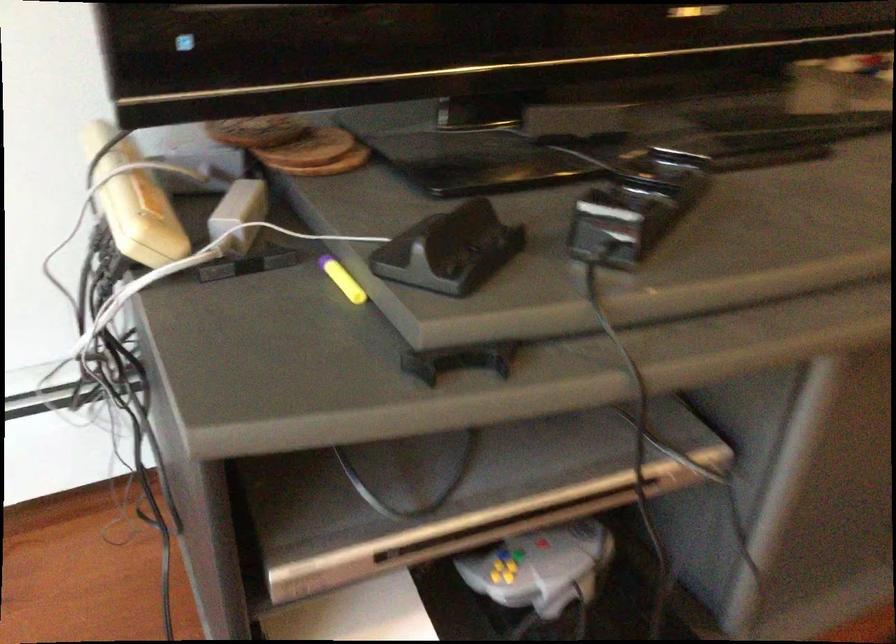
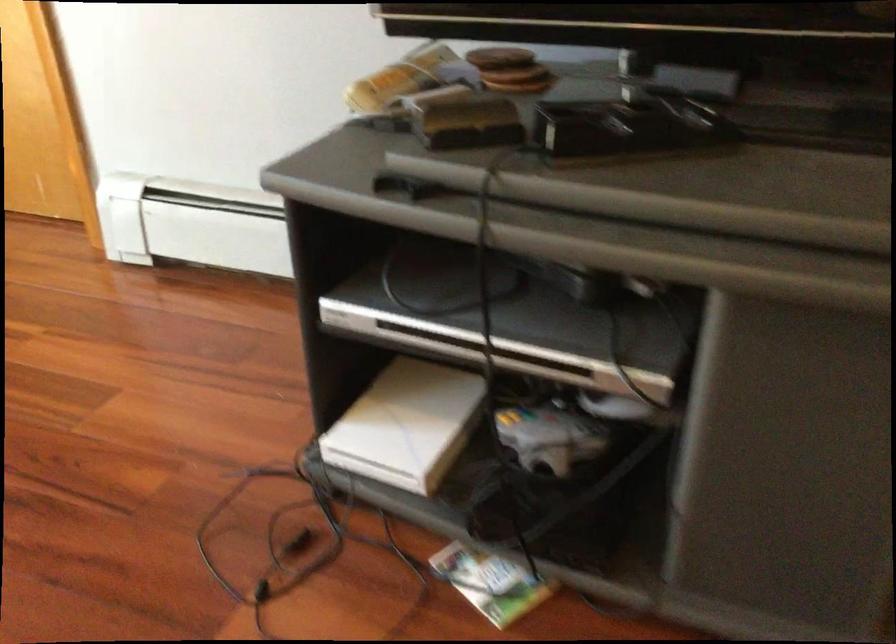
The point at (x=256, y=120) is marked in the first image. Where is the corresponding point in the second image?

(500, 58)